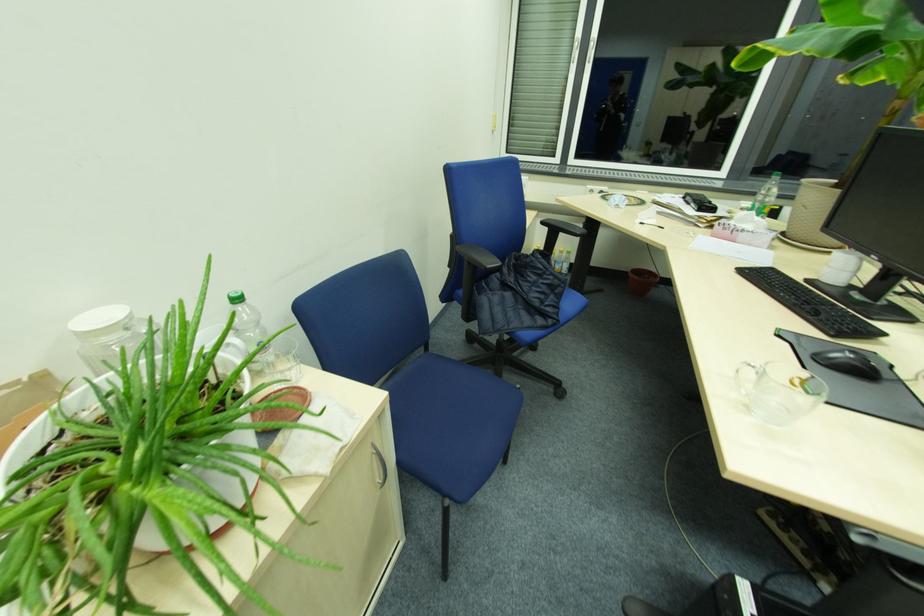
Find where to sit the blue chair sitting surface. Please return your answer as a coordinate pair (x, y).

(456, 413)